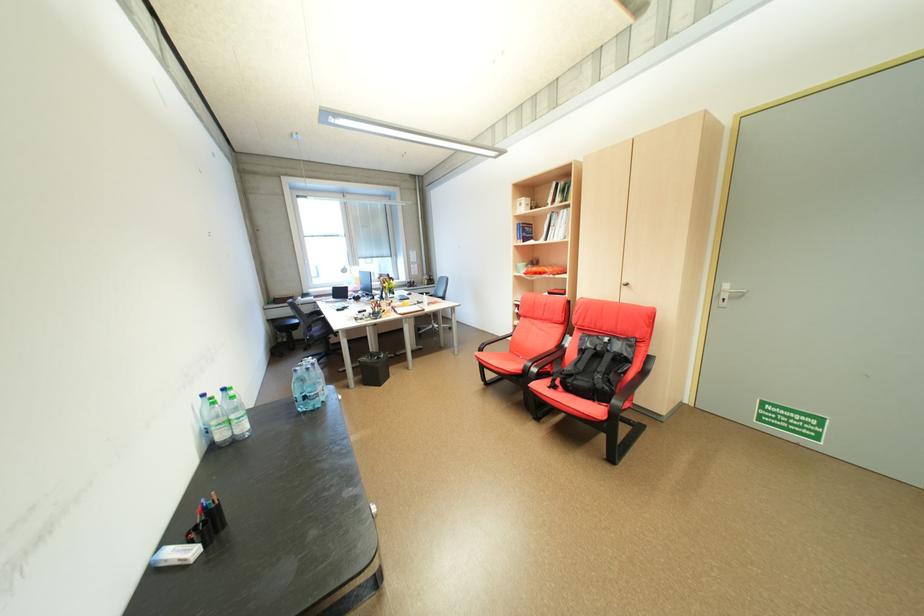
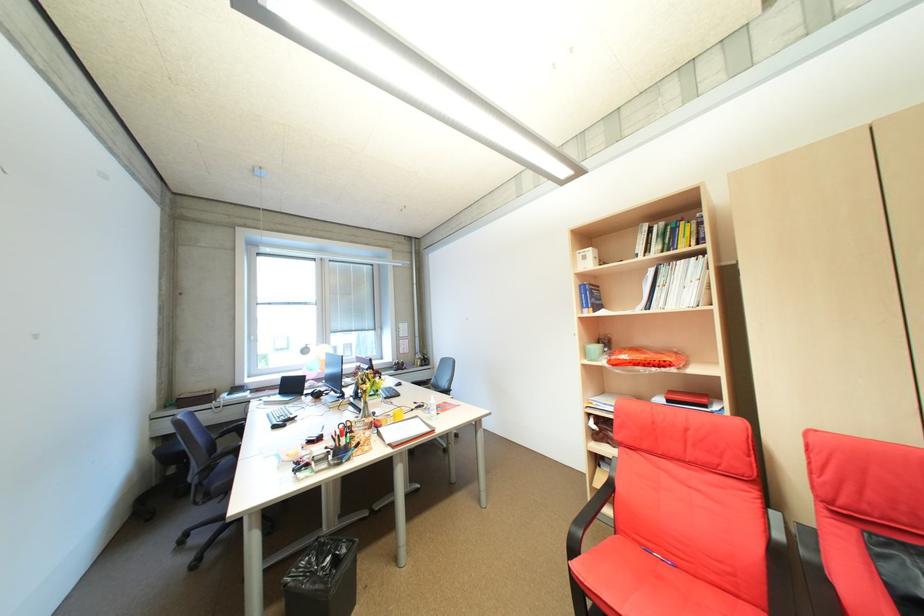
Where in the second image is the point corresponding to pixel 532 228 from the first image?

(600, 291)